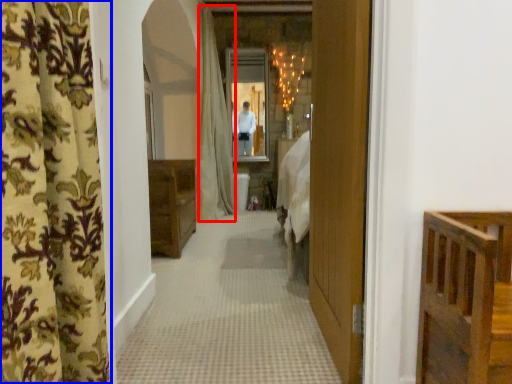
Question: Which object is further to the camera taking this photo, shower curtain (highlighted by a red box) or curtain (highlighted by a blue box)?

Choices:
 (A) shower curtain
 (B) curtain

Answer: (A)